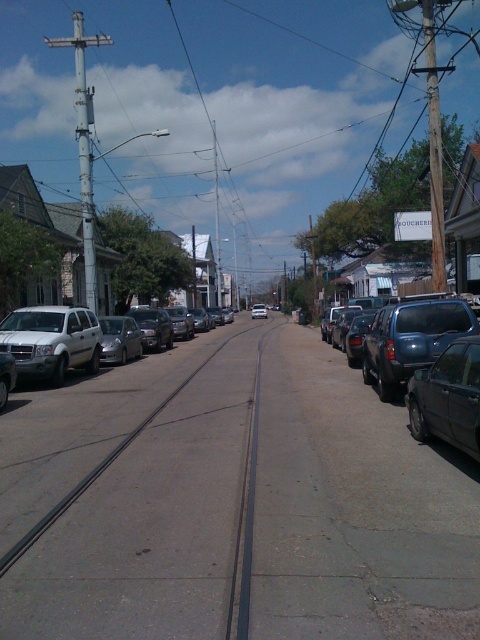
You are a delivery person trying to unload a package from the silver metallic sedan at center. The package is too heavy to lift directly onto the gray concrete pavement at center. Do you need a ramp or step to lower it down?

The gray concrete pavement at center is not as tall as silver metallic sedan at center, so you will need a ramp or step to lower the package down safely.

You are a pedestrian standing on the gray concrete pavement at center and want to cross the street to reach the BOUTIQUE sign on the far side. Is the metallic blue sedan at right blocking your path?

The gray concrete pavement at center is to the left of the metallic blue sedan at right, so the sedan is positioned to the right of the pavement. Since you are on the pavement, the sedan is not directly blocking your path to cross the street to the BOUTIQUE sign on the far side.

You are standing on the sidewalk and want to cross the street to reach the BOUTIQUE store across the street. The tram tracks are in the middle of the street. Can you step onto the gray concrete pavement at center to cross safely?

The gray concrete pavement at center is located at point (x=232, y=502), which is the safest place to cross the street between the tram tracks. Yes, you can step onto the gray concrete pavement at center to cross safely.